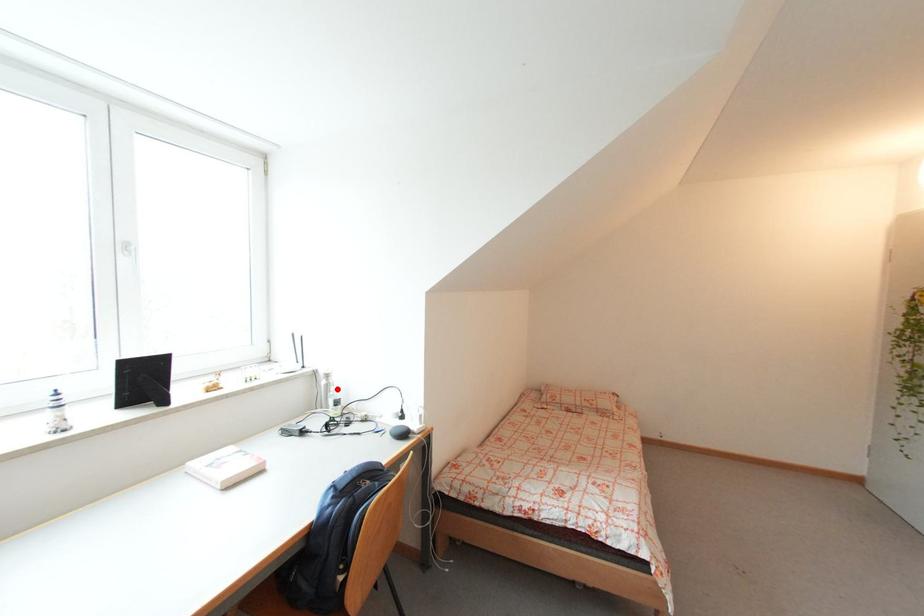
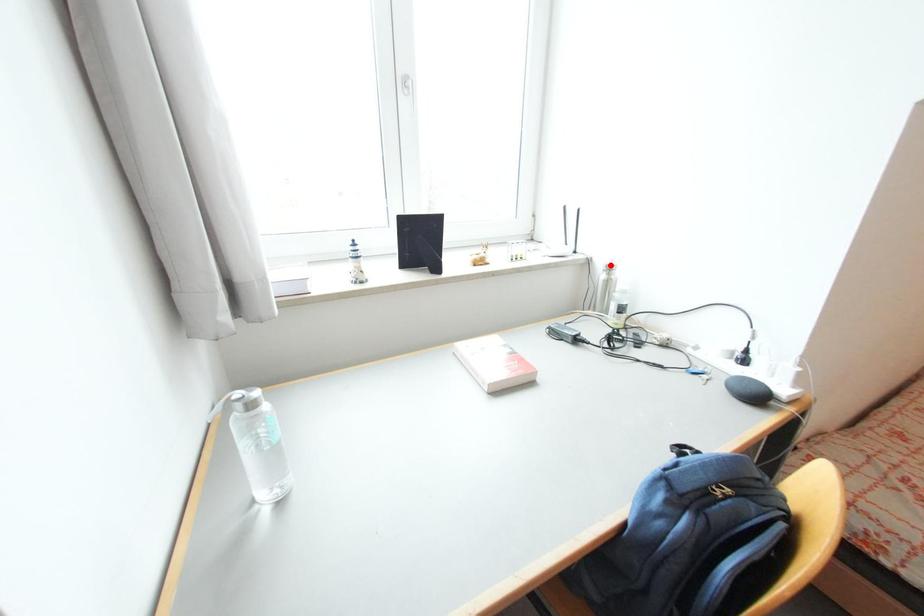
In the scene shown: I am providing you with two images of the same scene from different viewpoints. A red point is marked on the first image and another point is marked on the second image. Is the marked point in image1 the same physical position as the marked point in image2?

No